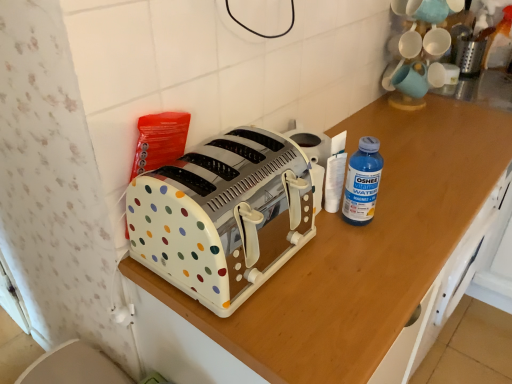
Identify the location of vacant area in front of white polka dot plastic toaster at center. (277, 331).